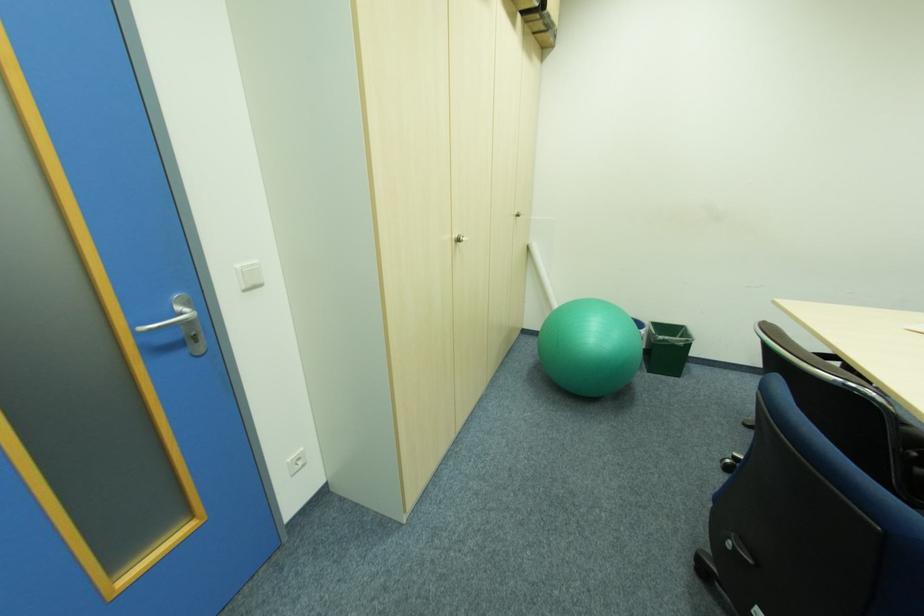
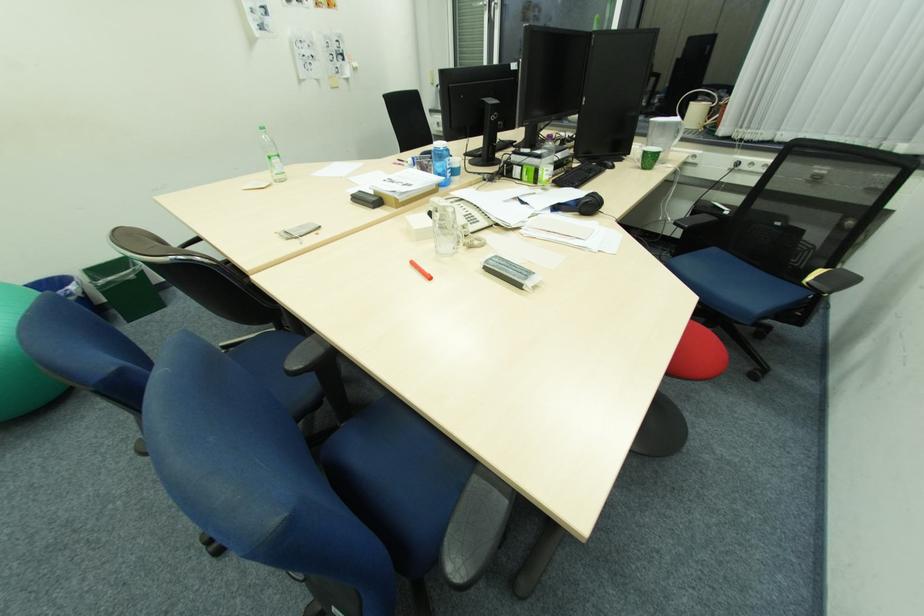
Find the pixel in the second image that matches point (670, 341) in the first image.

(115, 284)